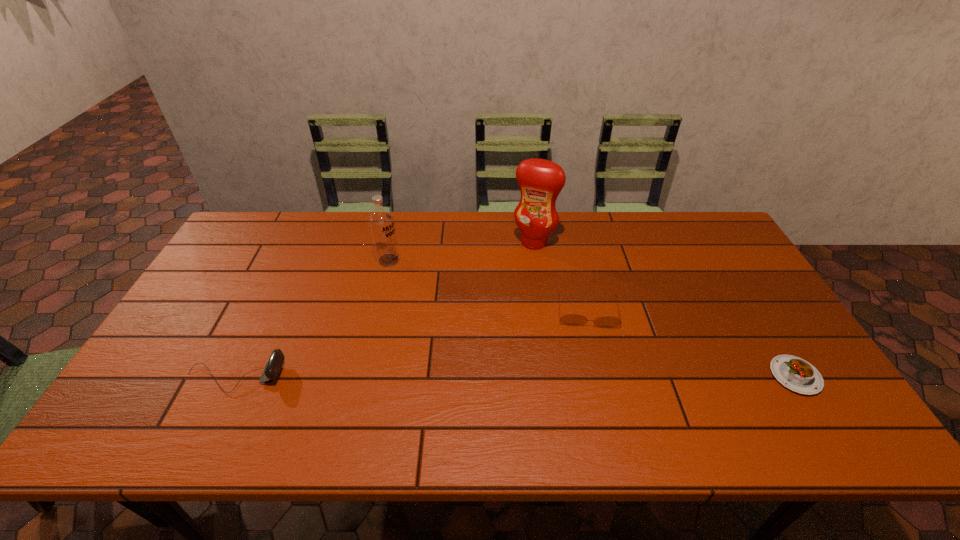
The image size is (960, 540). I want to click on vacant area that lies between the fourth object from right to left and the sunglasses, so 488,286.

Locate which object is the fourth closest to the leftmost object. Please provide its 2D coordinates. Your answer should be formatted as a tuple, i.e. [(x, y)], where the tuple contains the x and y coordinates of a point satisfying the conditions above.

[(798, 375)]

The height and width of the screenshot is (540, 960). What are the coordinates of `object that is the nearest to the leftmost object` in the screenshot? It's located at click(x=381, y=221).

Where is `free point that satisfies the following two spatial constraints: 1. on the front side of the rightmost object; 2. on the left side of the condiment`? Image resolution: width=960 pixels, height=540 pixels. free point that satisfies the following two spatial constraints: 1. on the front side of the rightmost object; 2. on the left side of the condiment is located at coordinates (553, 376).